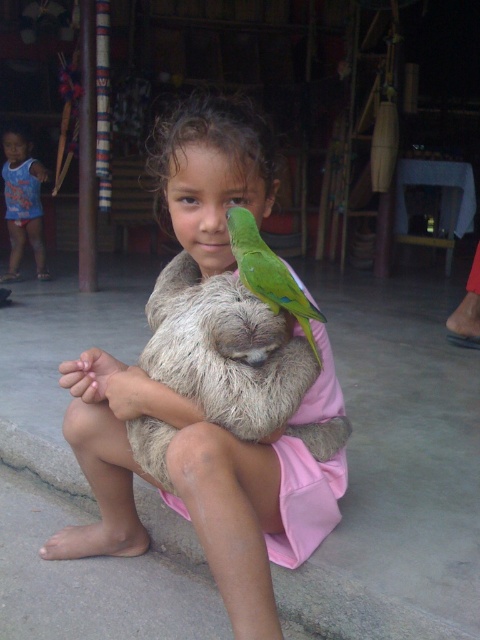
Question: Which of these objects is positioned closest to the green matte parrot at upper center?

Choices:
 (A) fuzzy brown sloth at center
 (B) blue cotton shirt at upper left

Answer: (A)

Question: Does fuzzy brown sloth at center appear under blue cotton dress at upper left?

Choices:
 (A) yes
 (B) no

Answer: (A)

Question: Is fuzzy brown sloth at center wider than blue cotton shirt at upper left?

Choices:
 (A) yes
 (B) no

Answer: (A)

Question: Which point is farther from the camera taking this photo?

Choices:
 (A) (349, 634)
 (B) (265, 248)

Answer: (A)

Question: Estimate the real-world distances between objects in this image. Which object is farther from the blue cotton shirt at upper left?

Choices:
 (A) green matte parrot at upper center
 (B) fuzzy brown sloth at center
 (C) gray concrete curb at lower left

Answer: (C)

Question: Is fuzzy brown sloth at center to the right of blue cotton shirt at upper left from the viewer's perspective?

Choices:
 (A) yes
 (B) no

Answer: (A)